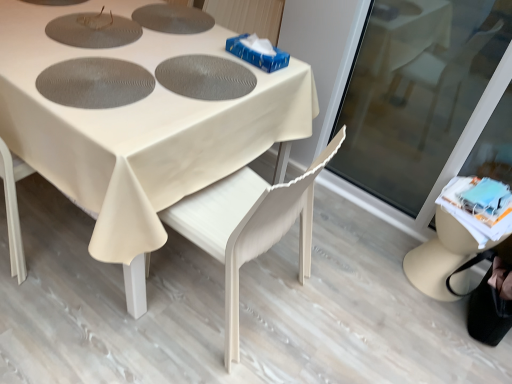
Question: From the image's perspective, would you say white fabric table at center is positioned over transparent glass screen door at lower right?

Choices:
 (A) yes
 (B) no

Answer: (A)

Question: Does white fabric table at center appear on the left side of transparent glass screen door at lower right?

Choices:
 (A) no
 (B) yes

Answer: (B)

Question: Can you confirm if white fabric table at center is smaller than transparent glass screen door at lower right?

Choices:
 (A) yes
 (B) no

Answer: (B)

Question: Is white fabric table at center positioned far away from transparent glass screen door at lower right?

Choices:
 (A) no
 (B) yes

Answer: (A)

Question: Could you tell me if white fabric table at center is facing transparent glass screen door at lower right?

Choices:
 (A) no
 (B) yes

Answer: (A)

Question: Considering the positions of point pos(104,129) and point pos(376,105), is point pos(104,129) closer or farther from the camera than point pos(376,105)?

Choices:
 (A) farther
 (B) closer

Answer: (B)

Question: In the image, is white fabric table at center positioned in front of or behind transparent glass screen door at lower right?

Choices:
 (A) behind
 (B) front

Answer: (B)

Question: Would you say white fabric table at center is to the left or to the right of transparent glass screen door at lower right in the picture?

Choices:
 (A) right
 (B) left

Answer: (B)

Question: Is white fabric table at center inside the boundaries of transparent glass screen door at lower right, or outside?

Choices:
 (A) inside
 (B) outside

Answer: (B)

Question: Is white wood chair at center spatially inside white fabric table at center, or outside of it?

Choices:
 (A) inside
 (B) outside

Answer: (A)

Question: From a real-world perspective, is white wood chair at center above or below white fabric table at center?

Choices:
 (A) below
 (B) above

Answer: (B)

Question: Relative to white fabric table at center, is white wood chair at center in front or behind?

Choices:
 (A) behind
 (B) front

Answer: (A)

Question: From the image's perspective, is white wood chair at center located above or below white fabric table at center?

Choices:
 (A) below
 (B) above

Answer: (A)

Question: In the image, is transparent glass screen door at lower right positioned in front of or behind white wood chair at center?

Choices:
 (A) behind
 (B) front

Answer: (A)

Question: Is point (499, 29) closer or farther from the camera than point (232, 210)?

Choices:
 (A) closer
 (B) farther

Answer: (B)